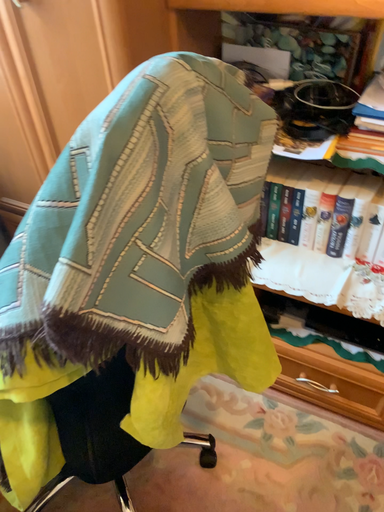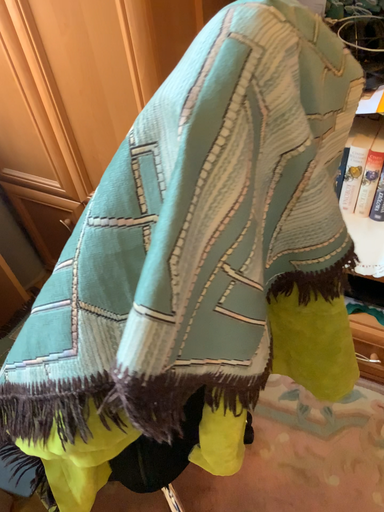
Question: Which way did the camera rotate in the video?

Choices:
 (A) rotated upward
 (B) rotated downward

Answer: (B)